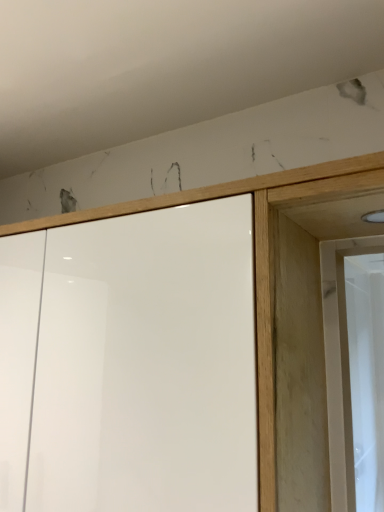
Question: From a real-world perspective, is white glossy cupboard at center above or below white glossy screen door at right?

Choices:
 (A) below
 (B) above

Answer: (A)

Question: Relative to white glossy screen door at right, is white glossy cupboard at center in front or behind?

Choices:
 (A) behind
 (B) front

Answer: (B)

Question: From the image's perspective, is white glossy cupboard at center positioned above or below white glossy screen door at right?

Choices:
 (A) above
 (B) below

Answer: (B)

Question: Is white glossy screen door at right taller or shorter than white glossy cupboard at center?

Choices:
 (A) short
 (B) tall

Answer: (A)

Question: Is white glossy screen door at right to the left or to the right of white glossy cupboard at center in the image?

Choices:
 (A) left
 (B) right

Answer: (B)

Question: Considering the positions of point click(x=364, y=339) and point click(x=157, y=204), is point click(x=364, y=339) closer or farther from the camera than point click(x=157, y=204)?

Choices:
 (A) closer
 (B) farther

Answer: (B)

Question: Relative to white glossy cupboard at center, is white glossy screen door at right in front or behind?

Choices:
 (A) behind
 (B) front

Answer: (A)